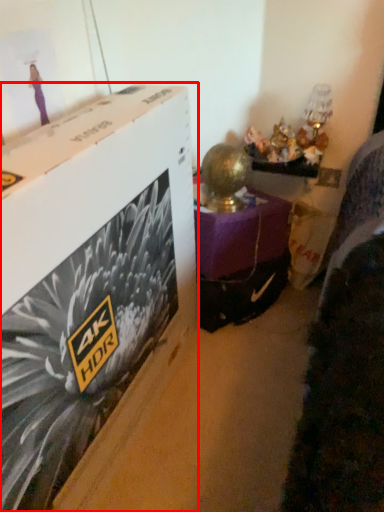
Question: From the image's perspective, what is the correct spatial positioning of box (annotated by the red box) in reference to furniture?

Choices:
 (A) above
 (B) below

Answer: (B)